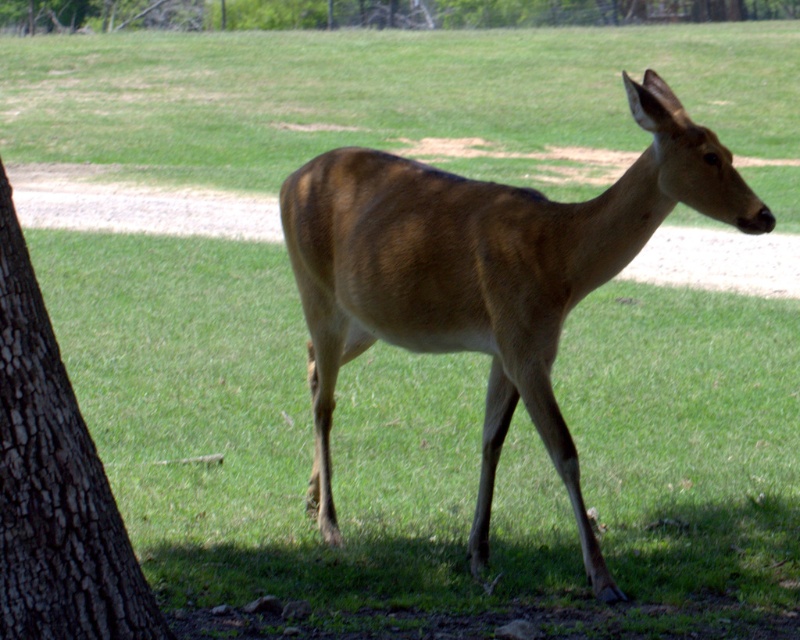
You are a wildlife photographer trying to capture the deer in the scene. You need to position your camera so that it is between the dark brown bark at left and the brown rough bark at upper center. Which bark should you place closer to your camera to ensure the deer stays in focus?

The dark brown bark at left has a smaller width than the brown rough bark at upper center, so you should position the camera closer to the dark brown bark at left to keep the deer in focus.